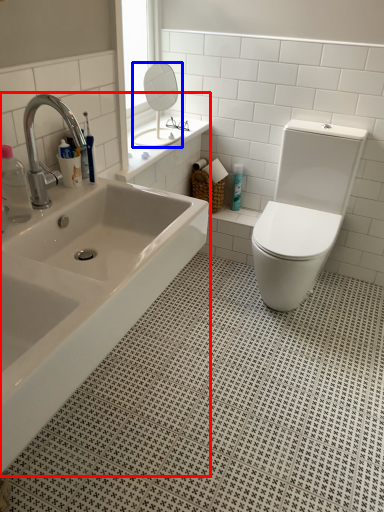
Question: Which object is further to the camera taking this photo, bathtub (highlighted by a red box) or mirror (highlighted by a blue box)?

Choices:
 (A) bathtub
 (B) mirror

Answer: (B)